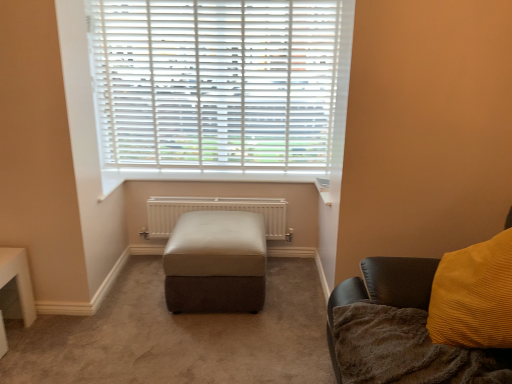
Where is `free space above leather ottoman at center (from a real-world perspective)`? The image size is (512, 384). free space above leather ottoman at center (from a real-world perspective) is located at coordinates (222, 225).